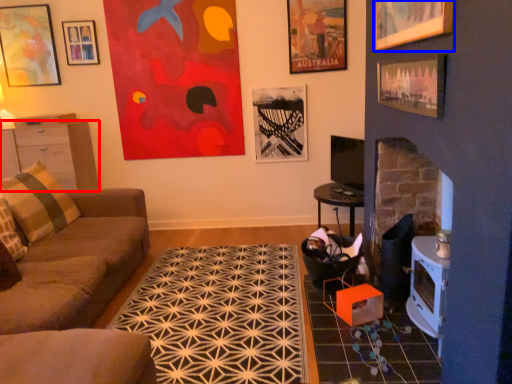
Question: Which object is further to the camera taking this photo, cabinetry (highlighted by a red box) or picture frame (highlighted by a blue box)?

Choices:
 (A) cabinetry
 (B) picture frame

Answer: (A)